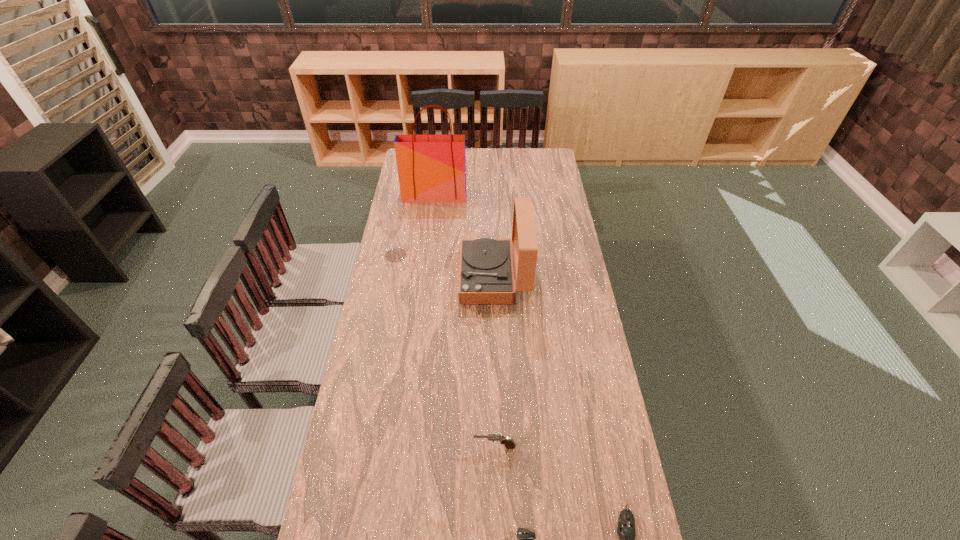
Where is `the tallest object`? the tallest object is located at coordinates (431, 168).

Find the location of a particular element. The image size is (960, 540). shopping bag is located at coordinates (431, 168).

This screenshot has width=960, height=540. Find the location of `phonograph record`. phonograph record is located at coordinates (486, 275).

In order to click on flute glass in this screenshot , I will do `click(390, 224)`.

Identify the location of the third nearest object. The image size is (960, 540). (497, 438).

Where is `pistol`? pistol is located at coordinates (497, 438).

This screenshot has width=960, height=540. Find the location of `vacant region located 0.310m on the handle side of the shopping bag`. vacant region located 0.310m on the handle side of the shopping bag is located at coordinates (429, 244).

The height and width of the screenshot is (540, 960). What are the coordinates of `vacant space located on the face of the second tallest object` in the screenshot? It's located at (400, 277).

Where is `vacant space located 0.270m on the face of the second tallest object`? vacant space located 0.270m on the face of the second tallest object is located at coordinates (396, 277).

I want to click on free space located 0.130m on the face of the second tallest object, so click(x=429, y=277).